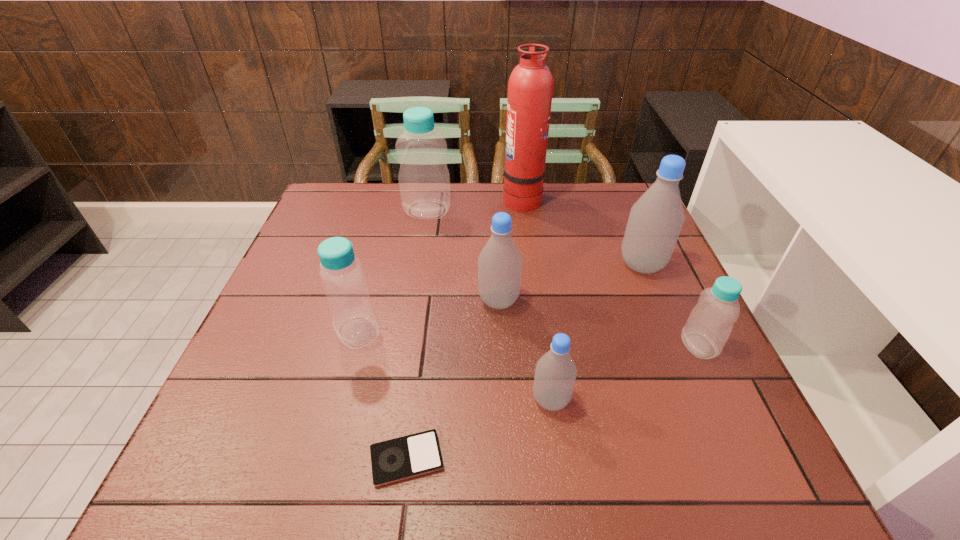
Image resolution: width=960 pixels, height=540 pixels. Find the location of `vacant area that lies between the farthest gray bottle and the iPod`. vacant area that lies between the farthest gray bottle and the iPod is located at coordinates (524, 362).

Identify the location of object that is the fifth closest to the smallest gray bottle. (655, 221).

Select which object is the closest to the fourth bottle from right to left. Please provide its 2D coordinates. Your answer should be formatted as a tuple, i.e. [(x, y)], where the tuple contains the x and y coordinates of a point satisfying the conditions above.

[(555, 374)]

Locate an element on the screen. The image size is (960, 540). the fourth closest bottle to the second biggest blue bottle is located at coordinates (655, 221).

Locate an element on the screen. The height and width of the screenshot is (540, 960). the second closest bottle to the fire extinguisher is located at coordinates (655, 221).

Select which blue bottle appears as the closest to the smallest blue bottle. Please provide its 2D coordinates. Your answer should be formatted as a tuple, i.e. [(x, y)], where the tuple contains the x and y coordinates of a point satisfying the conditions above.

[(342, 276)]

Choose which blue bottle is the second nearest neighbor to the second nearest gray bottle. Please provide its 2D coordinates. Your answer should be formatted as a tuple, i.e. [(x, y)], where the tuple contains the x and y coordinates of a point satisfying the conditions above.

[(424, 181)]

Where is `the closest gray bottle to the rightmost gray bottle`? The image size is (960, 540). the closest gray bottle to the rightmost gray bottle is located at coordinates (x=499, y=263).

Point out which gray bottle is positioned as the second nearest to the shortest object. Please provide its 2D coordinates. Your answer should be formatted as a tuple, i.e. [(x, y)], where the tuple contains the x and y coordinates of a point satisfying the conditions above.

[(499, 263)]

Locate an element on the screen. free spot that satisfies the following two spatial constraints: 1. on the front side of the biggest blue bottle; 2. on the left side of the third bottle from right to left is located at coordinates (396, 400).